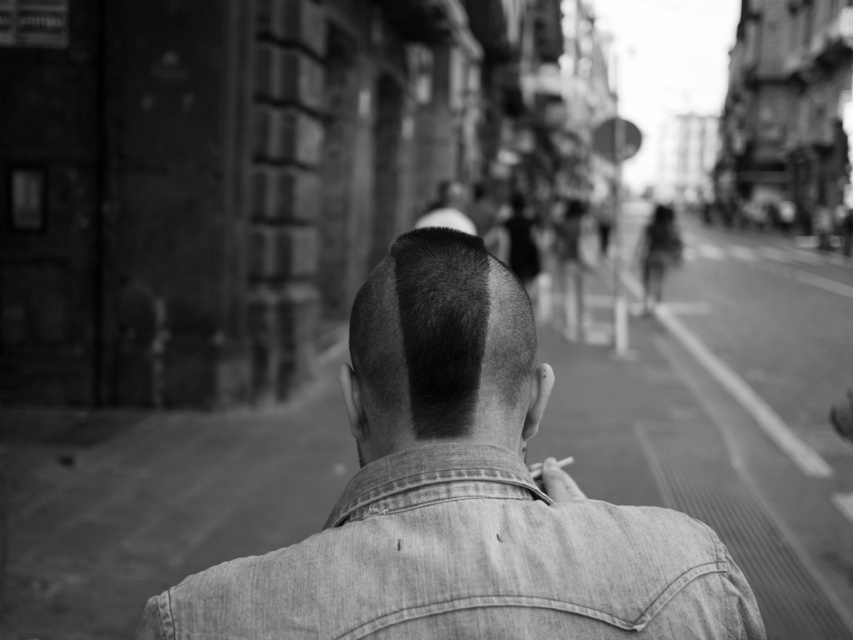
Can you confirm if denim jacket at center is shorter than faded denim jacket at lower right?

No.

Based on the photo, which is below, denim jacket at center or faded denim jacket at lower right?

faded denim jacket at lower right is below.

The width and height of the screenshot is (853, 640). What do you see at coordinates (461, 497) in the screenshot?
I see `denim jacket at center` at bounding box center [461, 497].

Find the location of a particular element. The width and height of the screenshot is (853, 640). denim jacket at center is located at coordinates (461, 497).

Between point (730, 593) and point (374, 316), which one is positioned in front?

Point (730, 593) is in front.

Locate an element on the screen. Image resolution: width=853 pixels, height=640 pixels. faded denim jacket at lower right is located at coordinates (469, 564).

Can you confirm if denim jacket at center is taller than short hair at center?

Yes, denim jacket at center is taller than short hair at center.

Between point (474, 592) and point (486, 266), which one is positioned behind?

Positioned behind is point (486, 266).

Find the location of a particular element. denim jacket at center is located at coordinates (461, 497).